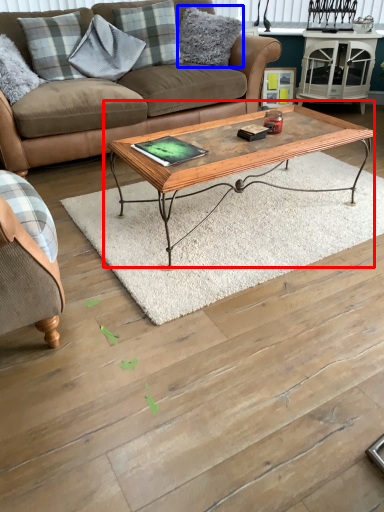
Question: Which point is further to the camera, coffee table (highlighted by a red box) or pillow (highlighted by a blue box)?

Choices:
 (A) coffee table
 (B) pillow

Answer: (B)